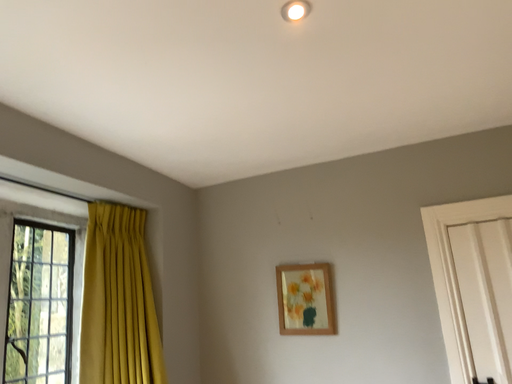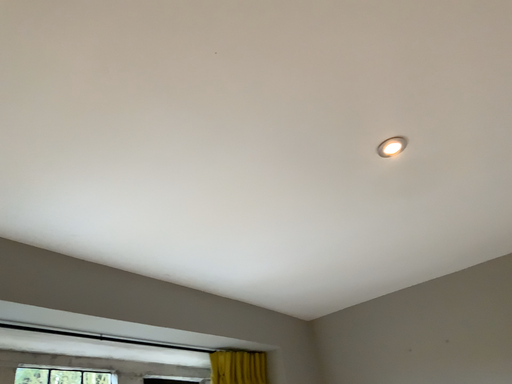
Question: Which way did the camera rotate in the video?

Choices:
 (A) rotated right
 (B) rotated left

Answer: (B)